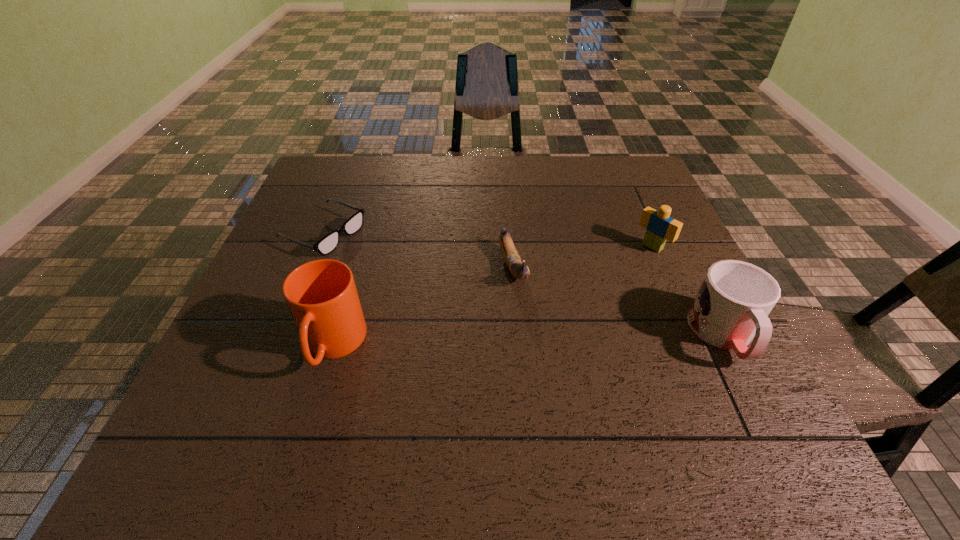
Where is `free space on the desktop that is between the left mug and the shorter mug and is positioned on the face of the Lego`? free space on the desktop that is between the left mug and the shorter mug and is positioned on the face of the Lego is located at coordinates (534, 340).

Identify the location of free space on the desktop that is between the tallest object and the right mug and is positioned at the stem of the third object from left to right. This screenshot has width=960, height=540. (544, 340).

Find the location of a particular element. The image size is (960, 540). vacant space on the desktop that is between the left mug and the right mug and is positioned on the front-facing side of the spectacles is located at coordinates (576, 339).